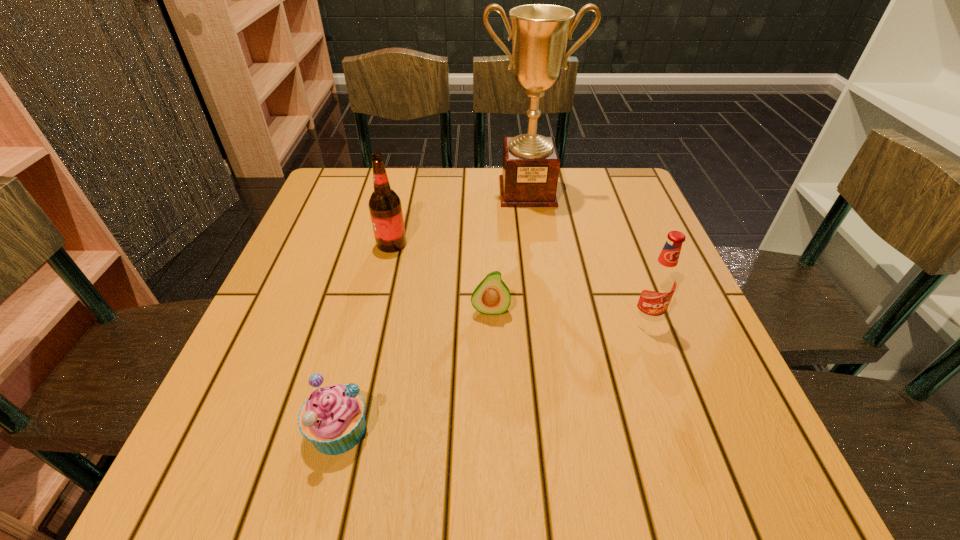
Image resolution: width=960 pixels, height=540 pixels. Identify the location of the farthest object. (540, 32).

Locate an element on the screen. This screenshot has height=540, width=960. the tallest object is located at coordinates (540, 32).

The image size is (960, 540). I want to click on the second farthest object, so point(385,207).

Identify the location of the farther root beer. (385, 207).

Find the location of a particular element. The height and width of the screenshot is (540, 960). the right root beer is located at coordinates (660, 281).

Find the location of `the nearer root beer`. the nearer root beer is located at coordinates (660, 281).

At what (x,y) coordinates should I click in order to perform the action: click on avocado. Please return your answer as a coordinate pair (x, y). The width and height of the screenshot is (960, 540). Looking at the image, I should click on (492, 296).

The width and height of the screenshot is (960, 540). I want to click on the nearest object, so coord(332,418).

Where is `free space located on the plaque of the farthest object`? This screenshot has width=960, height=540. free space located on the plaque of the farthest object is located at coordinates (542, 293).

Locate an element on the screen. vacant space located 0.220m on the right of the left root beer is located at coordinates (502, 244).